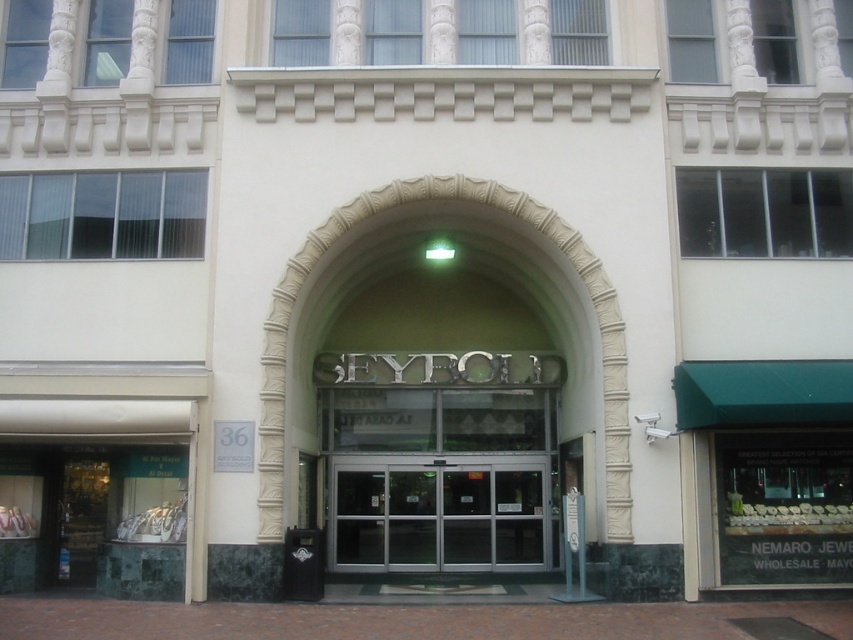
Question: Among these objects, which one is farthest from the camera?

Choices:
 (A) white stone archway at center
 (B) transparent glass doors at center
 (C) green marble display case at lower left

Answer: (B)

Question: Observing the image, what is the correct spatial positioning of green marble display case at lower left in reference to transparent glass doors at center?

Choices:
 (A) below
 (B) above

Answer: (B)

Question: Among these objects, which one is nearest to the camera?

Choices:
 (A) green marble display case at lower left
 (B) transparent glass doors at center

Answer: (A)

Question: Among these objects, which one is nearest to the camera?

Choices:
 (A) green marble display case at lower left
 (B) transparent glass doors at center
 (C) white stone archway at center

Answer: (A)

Question: Does transparent glass doors at center appear on the left side of white stone archway at center?

Choices:
 (A) yes
 (B) no

Answer: (B)

Question: Is green marble display case at lower left positioned behind transparent glass doors at center?

Choices:
 (A) yes
 (B) no

Answer: (B)